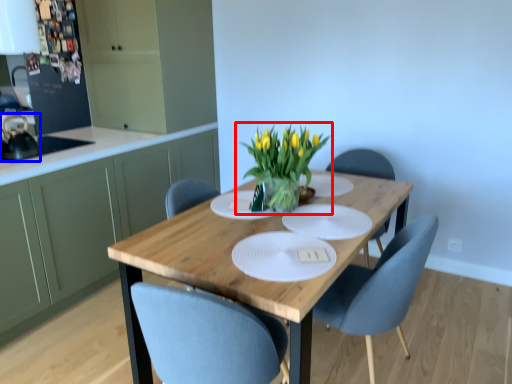
Question: Which point is further to the camera, houseplant (highlighted by a red box) or appliance (highlighted by a blue box)?

Choices:
 (A) houseplant
 (B) appliance

Answer: (B)